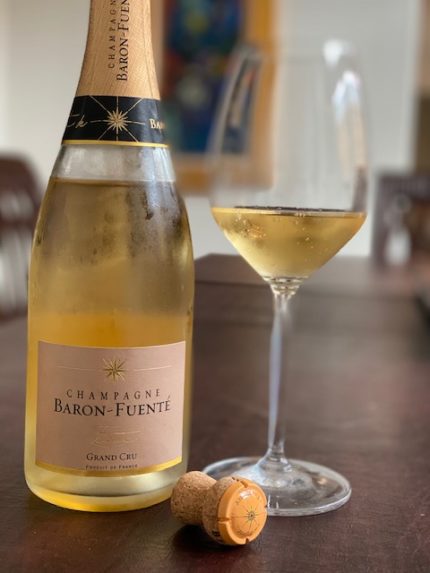
Image resolution: width=430 pixels, height=573 pixels. Identify the location of empty space on wall behind champagne bottle. (48, 81).